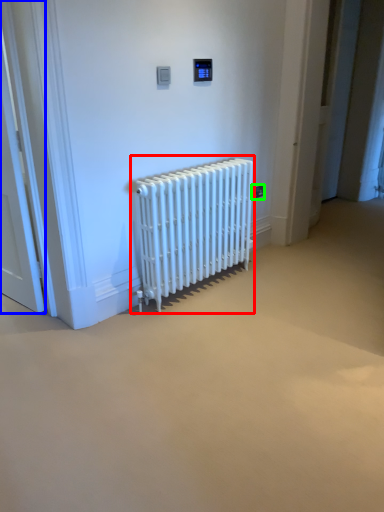
Question: Considering the real-world distances, which object is closest to radiator (highlighted by a red box)? door (highlighted by a blue box) or electric outlet (highlighted by a green box).

Choices:
 (A) door
 (B) electric outlet

Answer: (B)